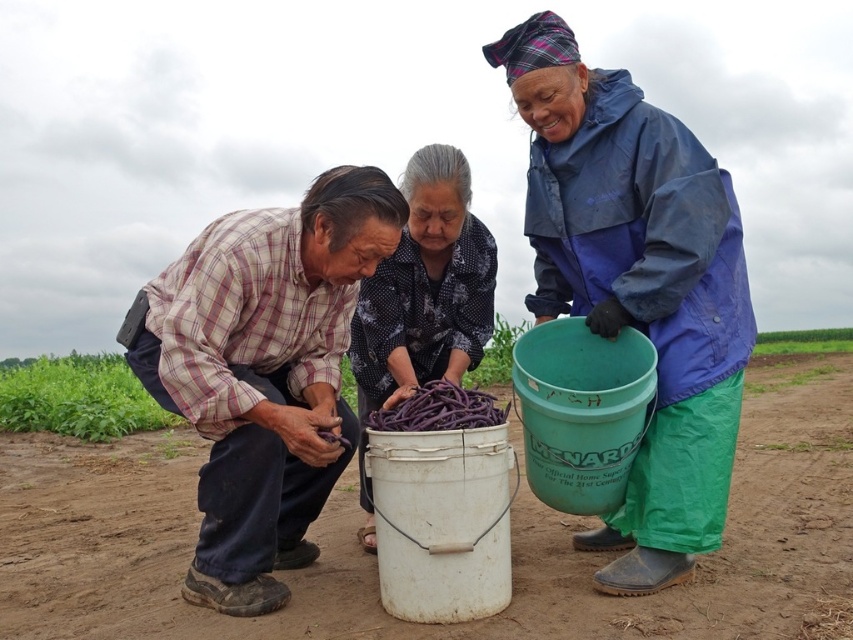
Does dirt field at lower center have a larger size compared to blue waterproof jacket at upper right?

Yes, dirt field at lower center is bigger than blue waterproof jacket at upper right.

Is the position of dirt field at lower center less distant than that of blue waterproof jacket at upper right?

Yes, dirt field at lower center is in front of blue waterproof jacket at upper right.

Who is more forward, (19, 464) or (677, 376)?

Positioned in front is point (677, 376).

Identify the location of dirt field at lower center. (375, 557).

Can you confirm if matte white bucket at center is positioned to the right of patterned fabric bucket at center?

Correct, you'll find matte white bucket at center to the right of patterned fabric bucket at center.

What do you see at coordinates (637, 284) in the screenshot? Image resolution: width=853 pixels, height=640 pixels. I see `matte white bucket at center` at bounding box center [637, 284].

You are a GUI agent. You are given a task and a screenshot of the screen. Output one action in this format:
    pyautogui.click(x=<x>, y=<y>)
    Task: Click on the matte white bucket at center
    
    Given the screenshot: What is the action you would take?
    pyautogui.click(x=637, y=284)

Can you confirm if matte white bucket at center is smaller than blue waterproof jacket at upper right?

No, matte white bucket at center is not smaller than blue waterproof jacket at upper right.

Does matte white bucket at center have a lesser width compared to blue waterproof jacket at upper right?

Incorrect, matte white bucket at center's width is not less than blue waterproof jacket at upper right's.

You are a GUI agent. You are given a task and a screenshot of the screen. Output one action in this format:
    pyautogui.click(x=<x>, y=<y>)
    Task: Click on the matte white bucket at center
    
    Given the screenshot: What is the action you would take?
    pyautogui.click(x=637, y=284)